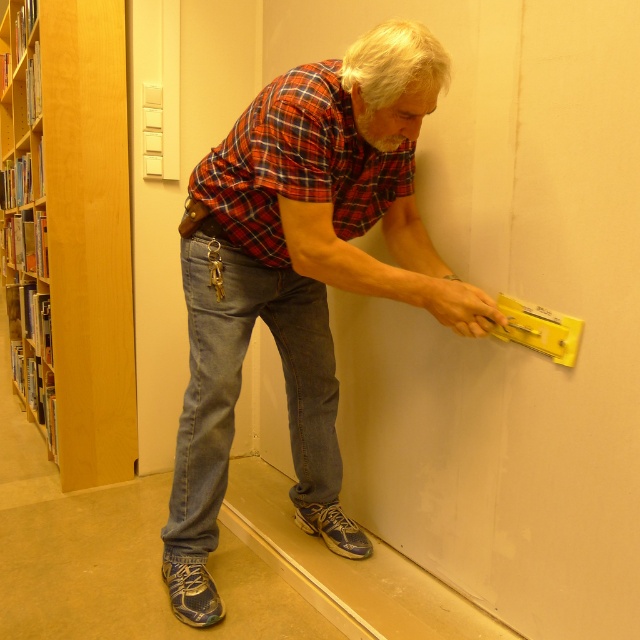
You are a delivery person who needs to place a large package between the matte plaid shirt at center and the wooden bookshelf at left. Can you fit the package if it measures 1.5 meters in length?

The distance between the matte plaid shirt at center and the wooden bookshelf at left is 1.80 meters. Since the package is 1.5 meters long, it can fit within the available space as 1.5 is less than 1.80.

The man is wearing two shirts layered over each other. The matte plaid shirt at center and the red plaid shirt at center. If the man wants to ensure there is at least 10 centimeters of space between the edges of his shirts when he moves his arms, is the current distance sufficient?

The distance between the matte plaid shirt at center and red plaid shirt at center is 11.71 centimeters, which is more than the required 10 centimeters. Therefore, the current distance is sufficient to maintain the desired space between the edges of his shirts when moving his arms.